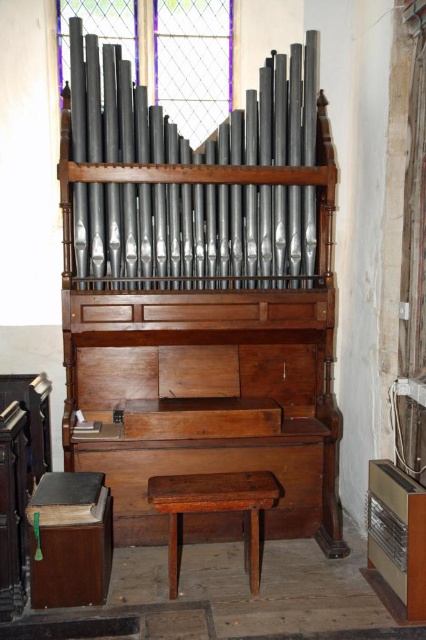
You are a musician preparing to play the organ. You notice the matte black pipes at center and the dark brown wood stool at center. Which object is located above the other?

The matte black pipes at center are positioned over the dark brown wood stool at center, meaning the pipes are above the stool.

You are a musician preparing to play the organ and need to place a music stand between the matte black pipes at center and the dark brown wood stool at center. Based on their widths, will the music stand fit between them?

The matte black pipes at center are wider than the dark brown wood stool at center, so there should be enough space between them to fit the music stand.